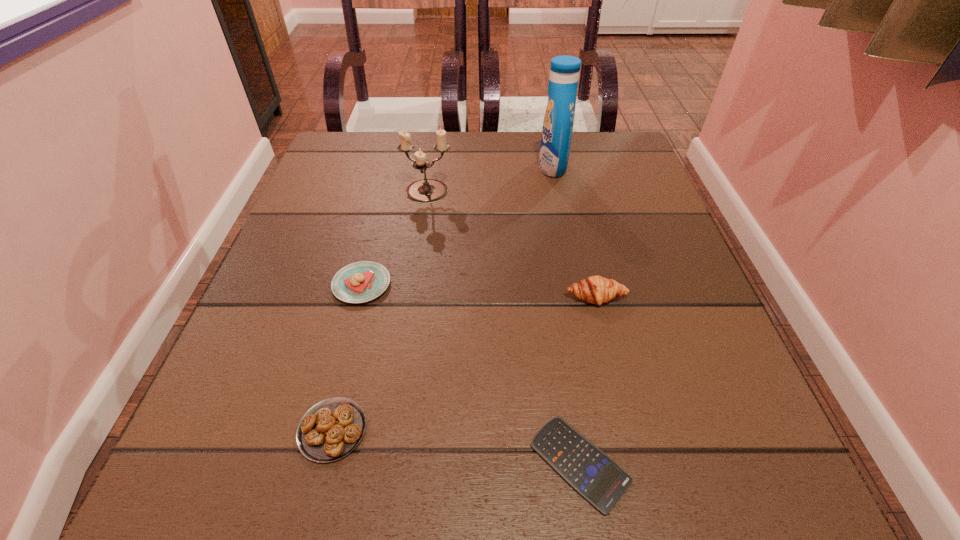
At what (x,y) coordinates should I click in order to perform the action: click on object present at the right edge. Please return your answer as a coordinate pair (x, y). This screenshot has width=960, height=540. Looking at the image, I should click on (596, 289).

At what (x,y) coordinates should I click in order to perform the action: click on object present at the near left corner. Please return your answer as a coordinate pair (x, y). Looking at the image, I should click on (331, 429).

What are the coordinates of `vacant area at the far edge` in the screenshot? It's located at tap(490, 154).

The width and height of the screenshot is (960, 540). In the image, there is a desktop. Identify the location of vacant region at the near edge. (479, 502).

Image resolution: width=960 pixels, height=540 pixels. I want to click on vacant space at the left edge, so click(334, 210).

The width and height of the screenshot is (960, 540). I want to click on vacant region at the right edge, so click(x=641, y=200).

The image size is (960, 540). What are the coordinates of `vacant space at the far left corner of the desktop` in the screenshot? It's located at (373, 164).

Identify the location of free spot at the far right corner of the desktop. This screenshot has width=960, height=540. (599, 159).

The image size is (960, 540). I want to click on empty space between the fourth tallest object and the calculator, so click(470, 374).

Identify the location of free spot between the shortest object and the nearest pastry. This screenshot has width=960, height=540. (456, 447).